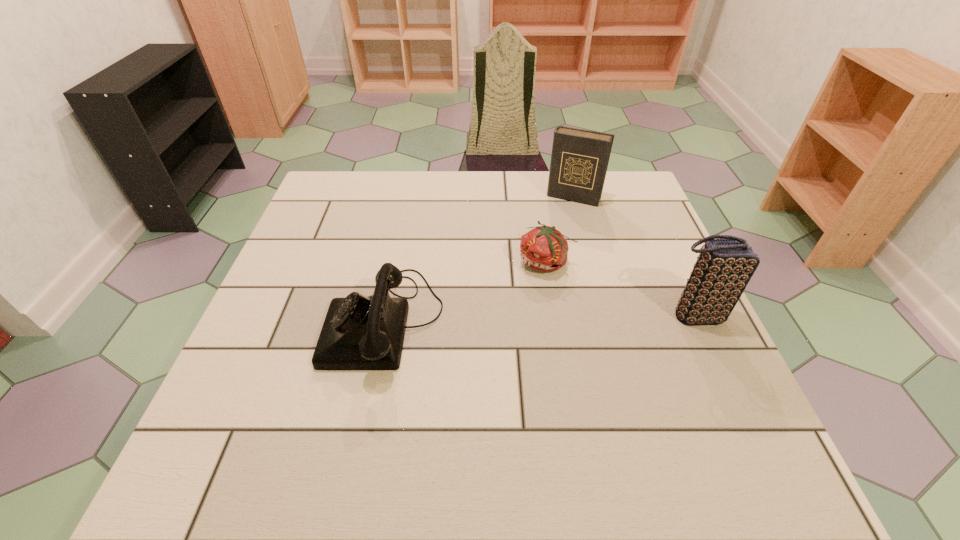
Where is `vacant point located on the front cover of the diary`? The height and width of the screenshot is (540, 960). vacant point located on the front cover of the diary is located at coordinates (537, 275).

You are a GUI agent. You are given a task and a screenshot of the screen. Output one action in this format:
    pyautogui.click(x=<x>, y=<y>)
    Task: Click on the vacant area located 0.170m on the front-facing side of the shortest object
    This screenshot has height=540, width=960.
    Given the screenshot: What is the action you would take?
    pyautogui.click(x=508, y=330)

Image resolution: width=960 pixels, height=540 pixels. Find the location of `free space located on the front-facing side of the shortest object`. free space located on the front-facing side of the shortest object is located at coordinates (525, 298).

You are a GUI agent. You are given a task and a screenshot of the screen. Output one action in this format:
    pyautogui.click(x=<x>, y=<y>)
    Task: Click on the free spot located 0.110m on the front-facing side of the shortest object
    The height and width of the screenshot is (540, 960).
    Given the screenshot: What is the action you would take?
    pyautogui.click(x=518, y=310)

The image size is (960, 540). What are the coordinates of `object that is at the far edge` in the screenshot? It's located at (579, 160).

Locate an element on the screen. The image size is (960, 540). object present at the near edge is located at coordinates (359, 333).

Where is `object at the left edge`? The width and height of the screenshot is (960, 540). object at the left edge is located at coordinates (359, 333).

Image resolution: width=960 pixels, height=540 pixels. In order to click on clutch bag at the right edge in this screenshot , I will do `click(724, 267)`.

At what (x,y) coordinates should I click in order to perform the action: click on diary positioned at the right edge. Please return your answer as a coordinate pair (x, y). Looking at the image, I should click on pyautogui.click(x=579, y=160).

Locate an element on the screen. object located at the near left corner is located at coordinates (359, 333).